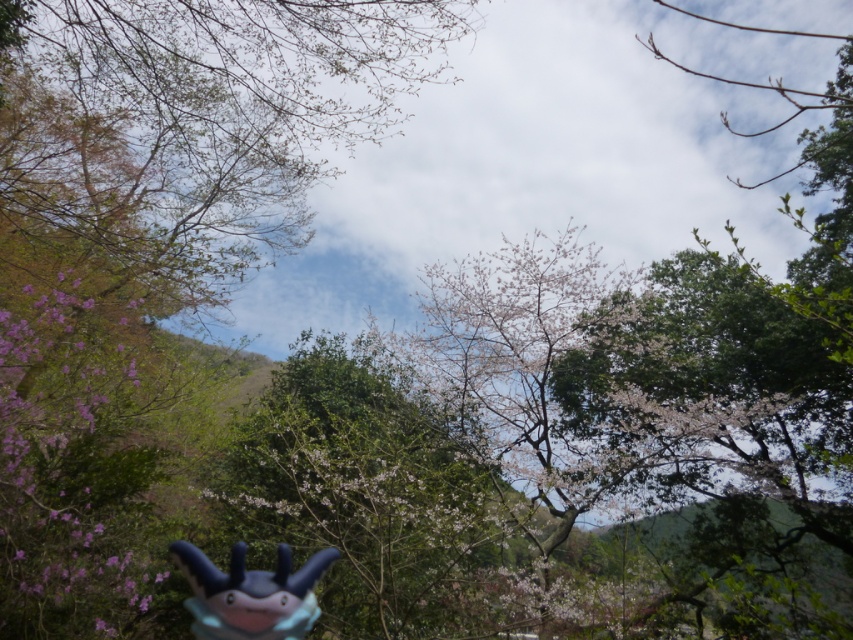
Is pink matte flower at left above matte blue plush toy at bottom center?

Actually, pink matte flower at left is below matte blue plush toy at bottom center.

Between point (54, 285) and point (189, 550), which one is positioned behind?

The point (54, 285) is behind.

Which is behind, point (39, 385) or point (305, 625)?

The point (39, 385) is more distant.

Identify the location of pink matte flower at left. The width and height of the screenshot is (853, 640). (76, 460).